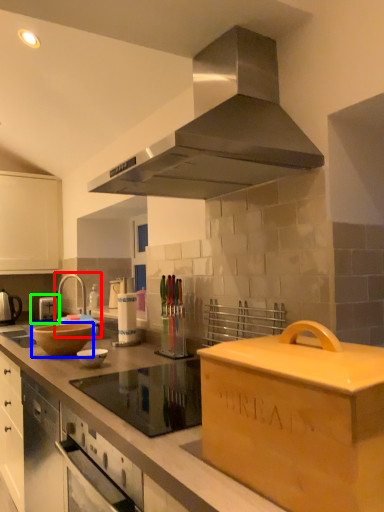
Question: Estimate the real-world distances between objects in this image. Which object is closer to sink (highlighted by a red box), mixing bowl (highlighted by a blue box) or appliance (highlighted by a green box)?

Choices:
 (A) mixing bowl
 (B) appliance

Answer: (B)